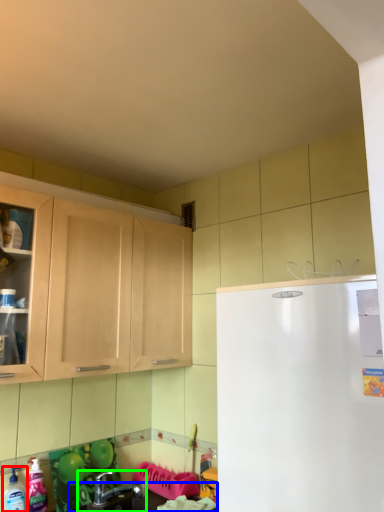
Question: Which is nearer to the cleaning product (highlighted by a red box)? counter top (highlighted by a blue box) or sink (highlighted by a green box).

Choices:
 (A) counter top
 (B) sink

Answer: (B)